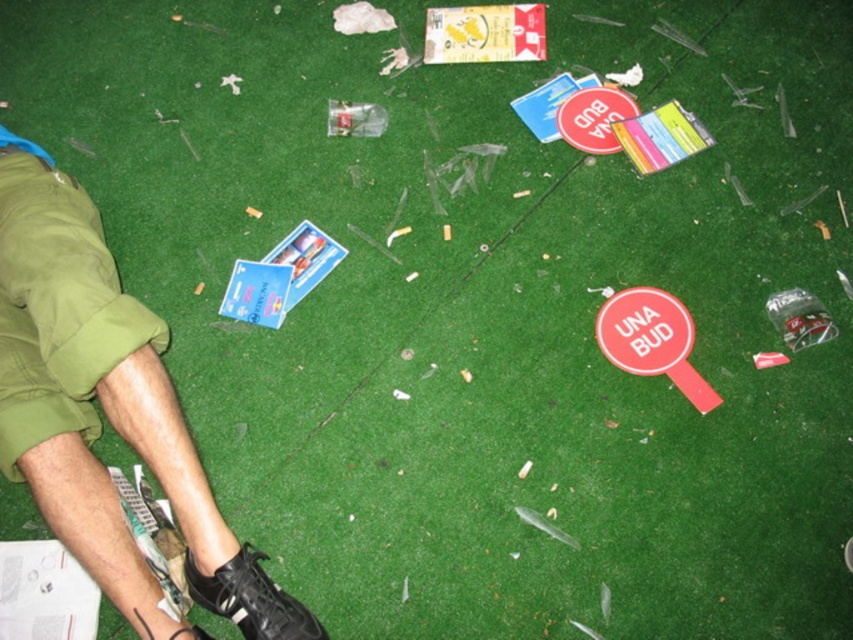
Based on the photo, you are a groundskeeper inspecting the artificial turf. You notice the red plastic sign at lower right and the black leather shoe at lower center. Which object is positioned more to the east if you are facing north?

The red plastic sign at lower right is to the right of black leather shoe at lower center. Since you are facing north, the red plastic sign at lower right is positioned more to the east compared to the black leather shoe at lower center.

You are a groundskeeper inspecting the sports field. You notice the green cotton shorts at lower left and the black leather shoe at lower center. Which item is positioned more to the left?

The green cotton shorts at lower left is positioned more to the left than the black leather shoe at lower center.